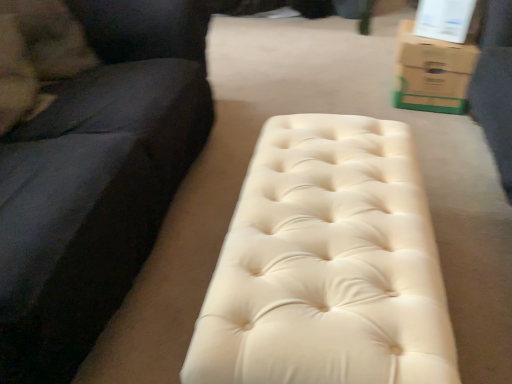
Locate an element on the screen. free spot above creamy leather bench at center (from a real-world perspective) is located at coordinates (322, 205).